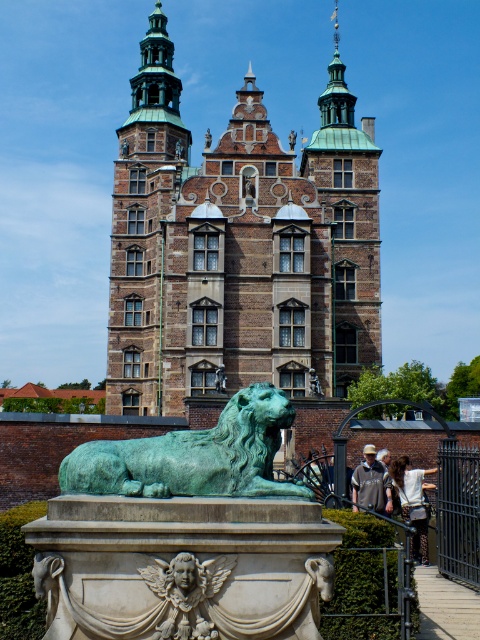
You are a GUI agent. You are given a task and a screenshot of the screen. Output one action in this format:
    pyautogui.click(x=<x>, y=<y>)
    Task: Click on the carved stone cherub at center
    The height and width of the screenshot is (640, 480).
    Given the screenshot: What is the action you would take?
    click(x=186, y=593)

Between point (191, 600) and point (321, 392), which one is positioned behind?

Positioned behind is point (321, 392).

Locate an element on the screen. carved stone cherub at center is located at coordinates (186, 593).

The height and width of the screenshot is (640, 480). I want to click on carved stone cherub at center, so 186,593.

Which is more to the right, green patina bronze lion at center or light brown hair at lower right?

light brown hair at lower right is more to the right.

Is green patina bronze lion at center thinner than light brown hair at lower right?

In fact, green patina bronze lion at center might be wider than light brown hair at lower right.

The image size is (480, 640). Identify the location of green patina bronze lion at center. (192, 456).

Which is below, carved stone cherub at center or gray fabric jacket at lower center?

gray fabric jacket at lower center

Between carved stone cherub at center and gray fabric jacket at lower center, which one appears on the left side from the viewer's perspective?

From the viewer's perspective, carved stone cherub at center appears more on the left side.

Is point (207, 627) closer to camera compared to point (355, 499)?

Yes, point (207, 627) is closer to viewer.

The height and width of the screenshot is (640, 480). What are the coordinates of `carved stone cherub at center` in the screenshot? It's located at (186, 593).